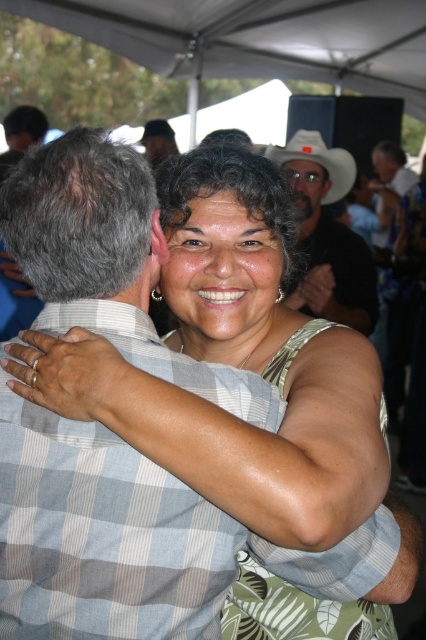
Who is positioned more to the right, matte black cowboy hat at upper center or white matte cowboy hat at upper center?

matte black cowboy hat at upper center is more to the right.

Can you confirm if matte black cowboy hat at upper center is wider than white matte cowboy hat at upper center?

No, matte black cowboy hat at upper center is not wider than white matte cowboy hat at upper center.

Which is in front, point (336, 227) or point (331, 200)?

Point (336, 227)

At what (x,y) coordinates should I click in order to perform the action: click on matte black cowboy hat at upper center. Please return your answer as a coordinate pair (x, y). Looking at the image, I should click on [328, 236].

Does white fabric canopy at upper center have a smaller size compared to white matte cowboy hat at upper center?

Actually, white fabric canopy at upper center might be larger than white matte cowboy hat at upper center.

Locate an element on the screen. white fabric canopy at upper center is located at coordinates (258, 38).

The width and height of the screenshot is (426, 640). What do you see at coordinates (258, 38) in the screenshot?
I see `white fabric canopy at upper center` at bounding box center [258, 38].

Find the location of `white fabric canopy at upper center`. white fabric canopy at upper center is located at coordinates (258, 38).

Is white fabric canopy at upper center positioned in front of matte black cowboy hat at upper center?

No, it is not.

Between white fabric canopy at upper center and matte black cowboy hat at upper center, which one is positioned lower?

matte black cowboy hat at upper center

Between point (135, 52) and point (370, 284), which one is positioned behind?

The point (135, 52) is behind.

I want to click on white fabric canopy at upper center, so click(258, 38).